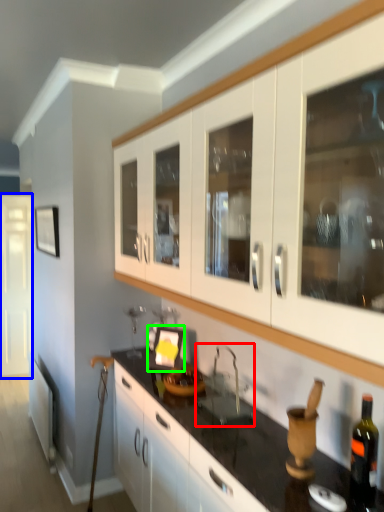
Question: Estimate the real-world distances between objects in this image. Which object is farther from sink (highlighted by a red box), glass door (highlighted by a blue box) or picture frame (highlighted by a green box)?

Choices:
 (A) glass door
 (B) picture frame

Answer: (A)